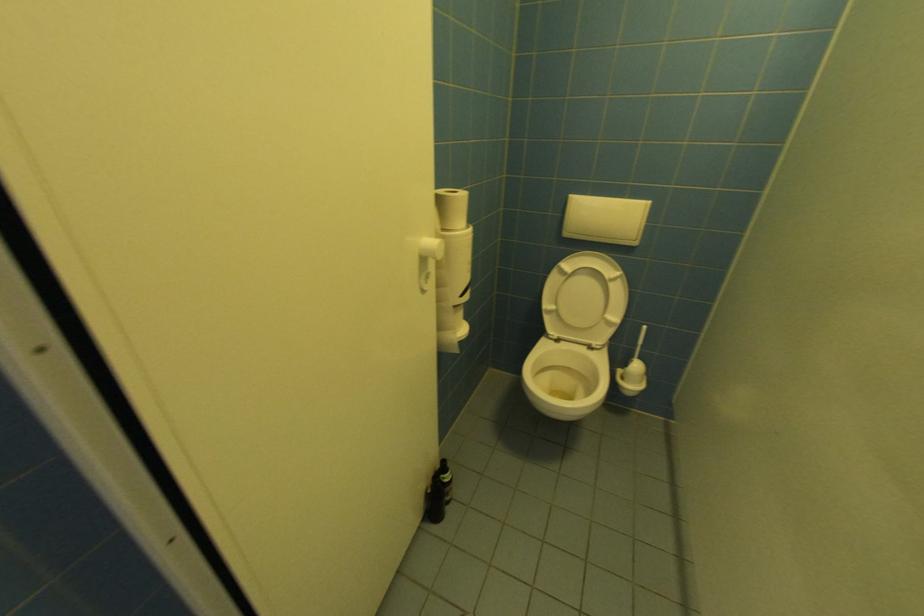
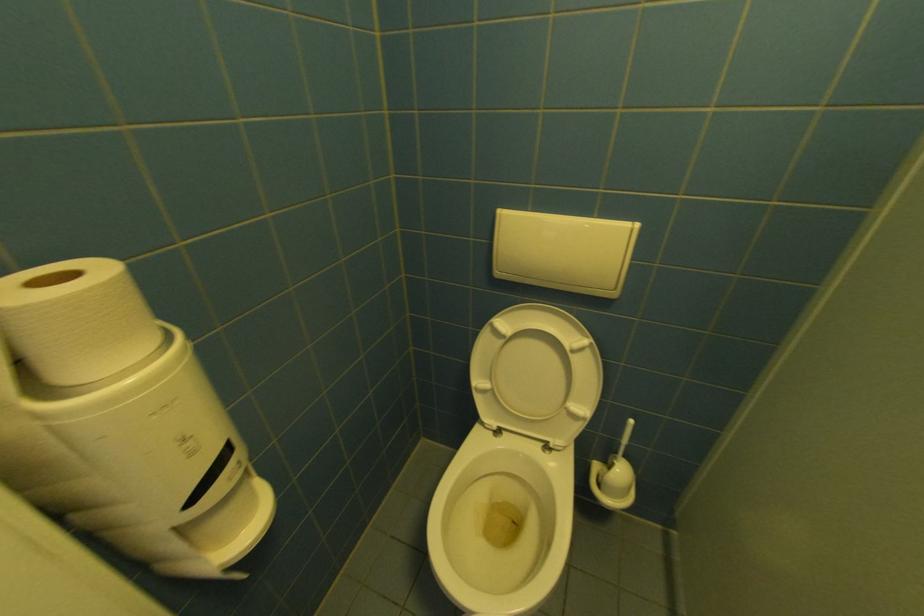
Looking at this image, what movement of the cameraman would produce the second image?

The cameraman moved toward right, forward.